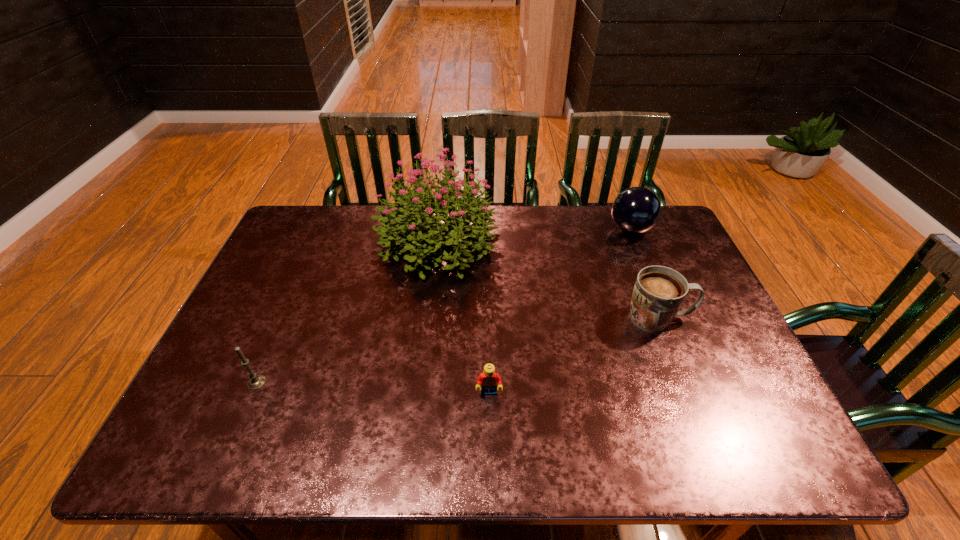
In the image, there is a desktop. Where is `vacant space at the right edge`? The height and width of the screenshot is (540, 960). vacant space at the right edge is located at coordinates click(x=695, y=268).

The image size is (960, 540). Find the location of `vacant region at the far left corner`. vacant region at the far left corner is located at coordinates (295, 248).

Locate an element on the screen. free point between the candle and the tallest object is located at coordinates pos(347,312).

Locate an element on the screen. This screenshot has width=960, height=540. free space between the bowling ball and the shortest object is located at coordinates coord(560,311).

Locate an element on the screen. free space between the leftmost object and the bowling ball is located at coordinates (444, 306).

Locate an element on the screen. free spot between the Lego and the third farthest object is located at coordinates tap(574, 355).

Find the location of a particular element. This screenshot has width=960, height=540. unoccupied position between the bouquet and the leftmost object is located at coordinates (347, 312).

Image resolution: width=960 pixels, height=540 pixels. I want to click on unoccupied area between the shortest object and the bouquet, so click(463, 317).

The image size is (960, 540). What are the coordinates of `unoccupied position between the bouquet and the bowling ball` in the screenshot? It's located at (534, 235).

Find the location of a particular element. This screenshot has width=960, height=540. vacant space in between the bowling ball and the tallest object is located at coordinates (534, 235).